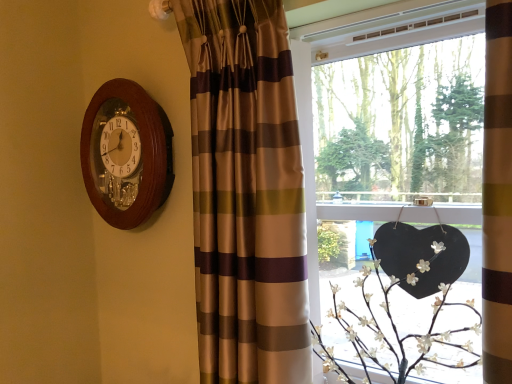
Question: Is white matte floral arrangement at lower right bigger or smaller than wooden wall clock at upper left?

Choices:
 (A) big
 (B) small

Answer: (A)

Question: Visually, is white matte floral arrangement at lower right positioned to the left or to the right of wooden wall clock at upper left?

Choices:
 (A) left
 (B) right

Answer: (B)

Question: Which is nearer to the brown striped curtain at left?

Choices:
 (A) wooden wall clock at upper left
 (B) matte black heart at right
 (C) white matte floral arrangement at lower right

Answer: (B)

Question: Considering the real-world distances, which object is farthest from the white matte floral arrangement at lower right?

Choices:
 (A) wooden wall clock at upper left
 (B) matte black heart at right
 (C) brown striped curtain at left

Answer: (A)